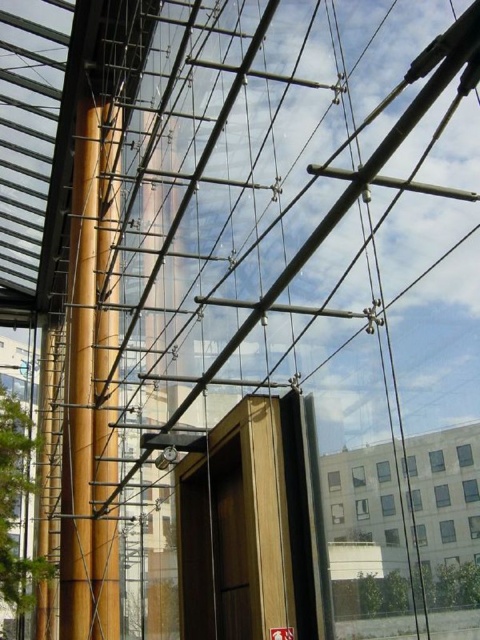
Question: Among these points, which one is farthest from the camera?

Choices:
 (A) (108, 305)
 (B) (70, 376)

Answer: (B)

Question: Where is wooden pole at center located in relation to yellow matte pole at center in the image?

Choices:
 (A) right
 (B) left

Answer: (B)

Question: Can you confirm if wooden pole at center is positioned to the left of yellow matte pole at center?

Choices:
 (A) yes
 (B) no

Answer: (A)

Question: Observing the image, what is the correct spatial positioning of wooden pole at center in reference to yellow matte pole at center?

Choices:
 (A) below
 (B) above

Answer: (B)